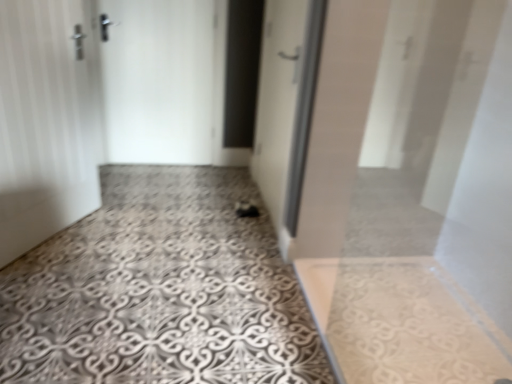
Question: Are white glossy door at center, the first door in the right-to-left sequence, and white matte door at left, the 3th door when ordered from right to left, located far from each other?

Choices:
 (A) no
 (B) yes

Answer: (B)

Question: From the image's perspective, is white glossy door at center, which is the 3th door from left to right, above white matte door at left, the 3th door when ordered from right to left?

Choices:
 (A) yes
 (B) no

Answer: (A)

Question: Considering the relative positions of white glossy door at center, the first door in the right-to-left sequence, and white matte door at left, acting as the 1th door starting from the left, in the image provided, is white glossy door at center, the first door in the right-to-left sequence, to the right of white matte door at left, acting as the 1th door starting from the left, from the viewer's perspective?

Choices:
 (A) no
 (B) yes

Answer: (B)

Question: From a real-world perspective, is white glossy door at center, the first door in the right-to-left sequence, below white matte door at left, acting as the 1th door starting from the left?

Choices:
 (A) no
 (B) yes

Answer: (A)

Question: Is white glossy door at center, the first door in the right-to-left sequence, positioned beyond the bounds of white matte door at left, the 3th door when ordered from right to left?

Choices:
 (A) no
 (B) yes

Answer: (B)

Question: Is white glossy door at center, the first door in the right-to-left sequence, behind white matte door at left, the 3th door when ordered from right to left?

Choices:
 (A) no
 (B) yes

Answer: (B)

Question: Is white matte door at left, the 3th door when ordered from right to left, not near white glossy door at center, the first door in the right-to-left sequence?

Choices:
 (A) no
 (B) yes

Answer: (B)

Question: From a real-world perspective, is white matte door at left, the 3th door when ordered from right to left, below white glossy door at center, which is the 3th door from left to right?

Choices:
 (A) no
 (B) yes

Answer: (B)

Question: Does white matte door at left, the 3th door when ordered from right to left, appear on the right side of white glossy door at center, which is the 3th door from left to right?

Choices:
 (A) yes
 (B) no

Answer: (B)

Question: Is white matte door at left, acting as the 1th door starting from the left, turned away from white glossy door at center, the first door in the right-to-left sequence?

Choices:
 (A) yes
 (B) no

Answer: (B)

Question: From a real-world perspective, is white matte door at left, the 3th door when ordered from right to left, positioned over white glossy door at center, the first door in the right-to-left sequence, based on gravity?

Choices:
 (A) no
 (B) yes

Answer: (A)

Question: Does white matte door at left, the 3th door when ordered from right to left, have a smaller size compared to white glossy door at center, the first door in the right-to-left sequence?

Choices:
 (A) no
 (B) yes

Answer: (B)

Question: Can you confirm if patterned concrete floor at center is taller than white matte door at left, the 3th door when ordered from right to left?

Choices:
 (A) no
 (B) yes

Answer: (A)